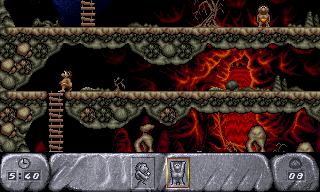
What are the coordinates of `red walls, illuminated on the right side` in the screenshot? It's located at (213, 61), (238, 123).